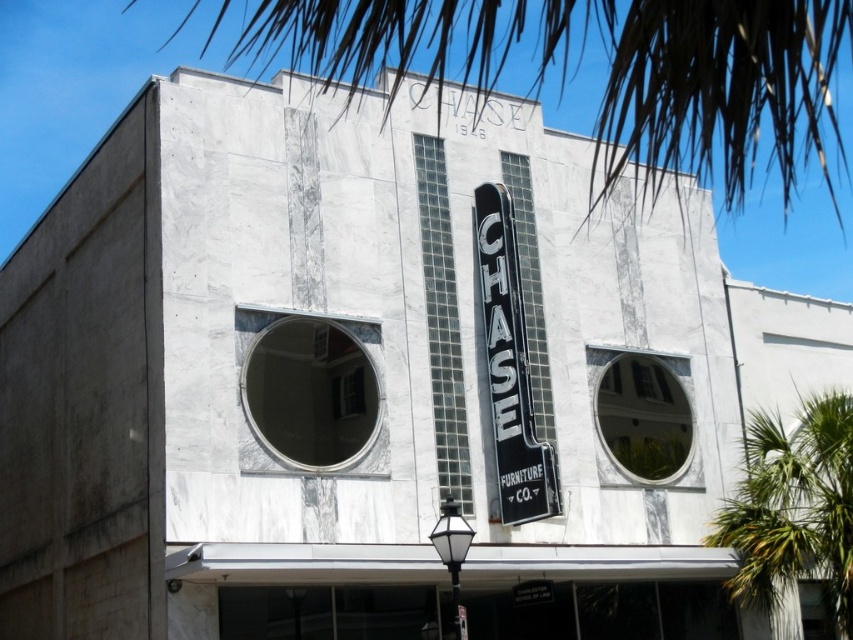
Looking at this image, you are a photographer planning to capture the black metal sign at center and the green leafy palm tree at right in a single frame. Based on the scene, which object occupies a larger portion of the image horizontally?

The green leafy palm tree at right has a greater width than the black metal sign at center, so it occupies a larger portion of the image horizontally.

You are standing in front of the CHASE Furniture Co. building and notice two palm trees. Which palm tree, the brown leafy palm tree at upper center or the green leafy palm tree at right, is taller?

The brown leafy palm tree at upper center is taller than the green leafy palm tree at right.

You are a drone operator who needs to fly a drone from the brown leafy palm tree at upper center to the green leafy palm tree at right. What is the approximate distance you need to cover?

The distance between the brown leafy palm tree at upper center and the green leafy palm tree at right is approximately 26.95 meters.